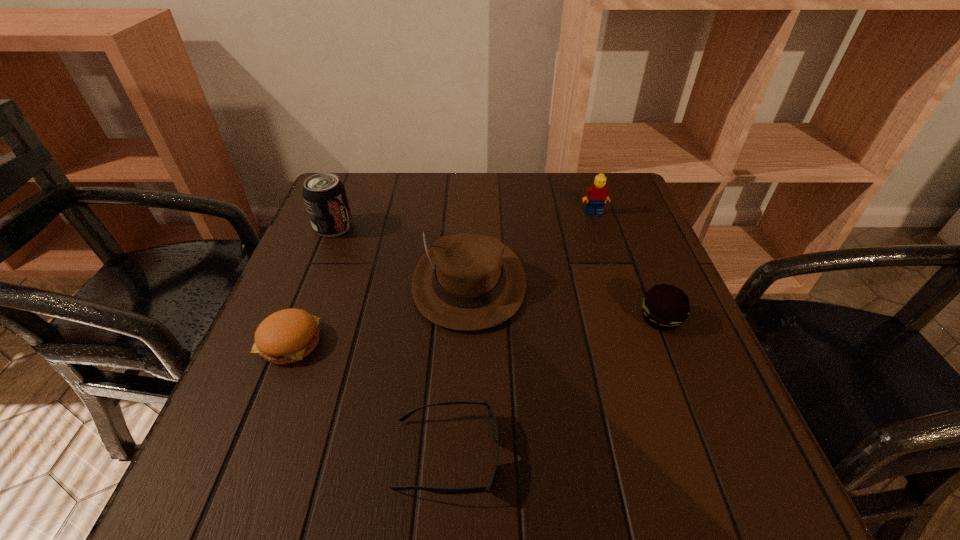
Where is `fedora`? The height and width of the screenshot is (540, 960). fedora is located at coordinates (467, 282).

Where is `the second farthest object`? This screenshot has height=540, width=960. the second farthest object is located at coordinates (324, 194).

The image size is (960, 540). Identify the location of the farthest object. (598, 193).

At what (x,y) coordinates should I click in order to perform the action: click on the third tallest object. Please return your answer as a coordinate pair (x, y). Looking at the image, I should click on (598, 193).

The width and height of the screenshot is (960, 540). Identify the location of the right patty. (665, 307).

The height and width of the screenshot is (540, 960). Identify the location of the fourth tallest object. (665, 307).

Find the location of a particular element. The image size is (960, 540). the left patty is located at coordinates (286, 336).

Identify the location of the shorter patty. This screenshot has height=540, width=960. (286, 336).

Find the location of a particular element. the shortest object is located at coordinates (491, 417).

Find the location of a particular element. sunglasses is located at coordinates (491, 417).